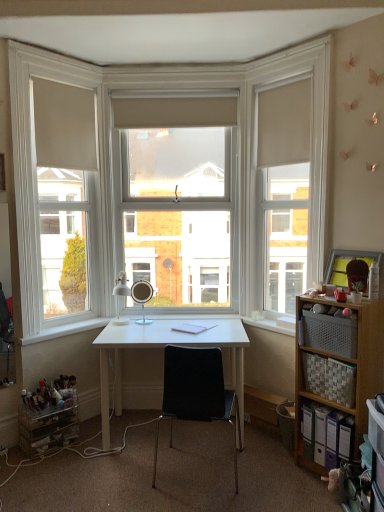
The height and width of the screenshot is (512, 384). In order to click on blank space above clear glass window at center (from a real-world perspective) in this screenshot , I will do `click(174, 67)`.